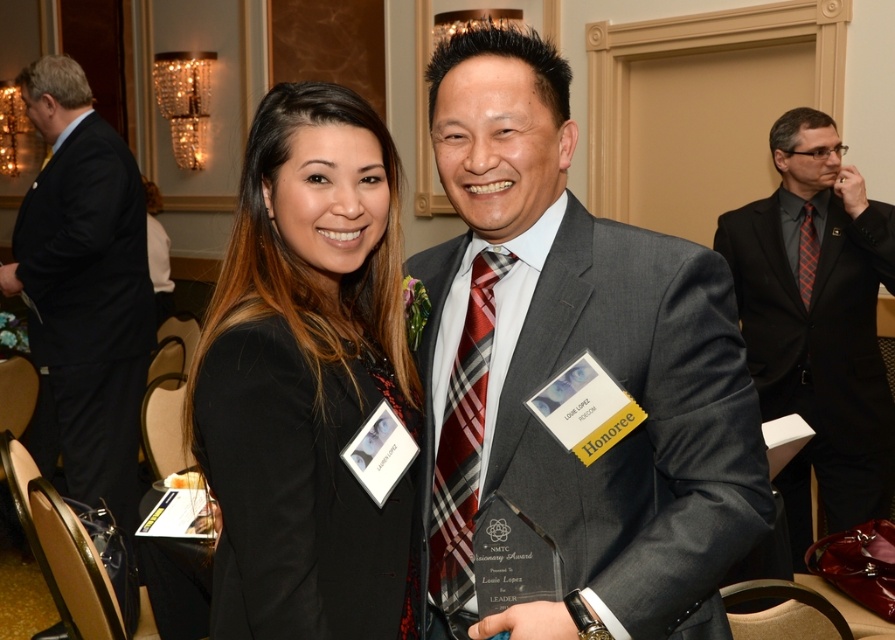
Question: Among these objects, which one is nearest to the camera?

Choices:
 (A) black matte blazer at center
 (B) gray suit at center
 (C) matte black suit at right
 (D) orange plaid tie at right

Answer: (A)

Question: Which of the following is the farthest from the observer?

Choices:
 (A) black matte blazer at center
 (B) gray suit at center
 (C) black suit at left

Answer: (C)

Question: Can you confirm if black matte blazer at center is positioned above orange plaid tie at right?

Choices:
 (A) yes
 (B) no

Answer: (B)

Question: Is black matte blazer at center to the right of plaid silk tie at center from the viewer's perspective?

Choices:
 (A) yes
 (B) no

Answer: (B)

Question: Where is black matte blazer at center located in relation to black suit at left in the image?

Choices:
 (A) left
 (B) right

Answer: (B)

Question: Which object is positioned closest to the plaid silk tie at center?

Choices:
 (A) matte black suit at right
 (B) black matte blazer at center
 (C) orange plaid tie at right

Answer: (B)